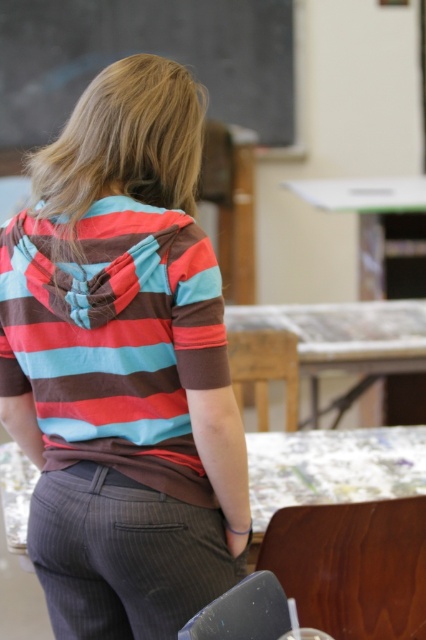
You are a student in the classroom. You need to place a book on the green plastic table at upper center. Can you place it directly above the striped cotton hoodie at center without touching the hoodie?

The striped cotton hoodie at center is positioned under the green plastic table at upper center, so yes, you can place the book directly above the striped cotton hoodie at center on the table without touching the hoodie.

You are a student in the classroom and want to write something on the black chalkboard at upper center. Where should you position yourself to reach it?

The black chalkboard at upper center is located at point (146, 51), so you should position yourself directly in front of that coordinate to reach it.

You are a student in the classroom and want to write a note on the black chalkboard at upper center and the wooden table at center. Which surface will you need more chalk to cover completely?

The black chalkboard at upper center has a larger width than the wooden table at center, so you will need more chalk to cover the black chalkboard at upper center completely.